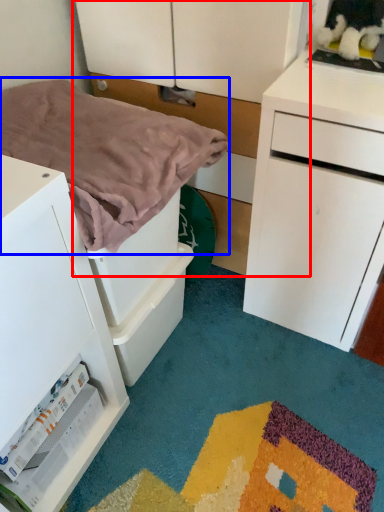
Question: Among these objects, which one is farthest to the camera, dresser (highlighted by a red box) or blanket (highlighted by a blue box)?

Choices:
 (A) dresser
 (B) blanket

Answer: (A)